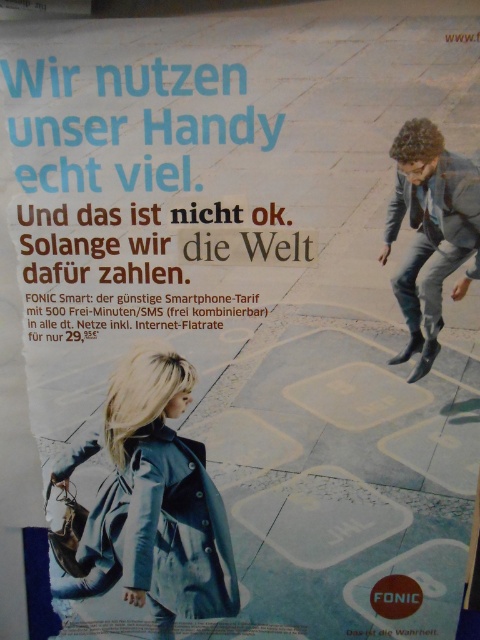
Does matte blue coat at lower left lie behind gray suit at right?

Yes, it is.

Consider the image. Does matte blue coat at lower left appear on the left side of gray suit at right?

Correct, you'll find matte blue coat at lower left to the left of gray suit at right.

You are a GUI agent. You are given a task and a screenshot of the screen. Output one action in this format:
    pyautogui.click(x=<x>, y=<y>)
    Task: Click on the matte blue coat at lower left
    The height and width of the screenshot is (640, 480).
    Given the screenshot: What is the action you would take?
    pyautogui.click(x=153, y=502)

Where is `matte blue coat at lower left`? The height and width of the screenshot is (640, 480). matte blue coat at lower left is located at coordinates (153, 502).